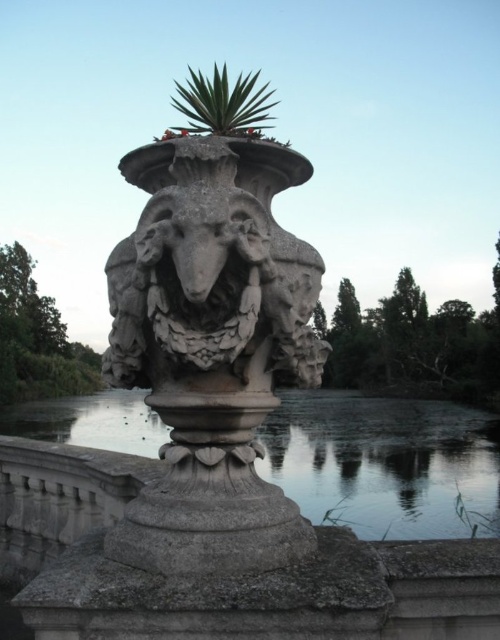
Can you confirm if transparent water at base center is shorter than green leafy plant at center?

Incorrect, transparent water at base center's height does not fall short of green leafy plant at center's.

Can you confirm if transparent water at base center is bigger than green leafy plant at center?

Indeed, transparent water at base center has a larger size compared to green leafy plant at center.

Where is `transparent water at base center`? The image size is (500, 640). transparent water at base center is located at coordinates (382, 461).

Consider the image. Who is positioned more to the right, green leafy plant at top or green leafy plant at center?

green leafy plant at center

Can you confirm if green leafy plant at top is bigger than green leafy plant at center?

Yes.

The image size is (500, 640). What do you see at coordinates (222, 104) in the screenshot?
I see `green leafy plant at top` at bounding box center [222, 104].

The image size is (500, 640). Find the location of `green leafy plant at top`. green leafy plant at top is located at coordinates (222, 104).

Can you confirm if transparent water at base center is thinner than green leafy plant at top?

No, transparent water at base center is not thinner than green leafy plant at top.

This screenshot has width=500, height=640. Find the location of `transparent water at base center`. transparent water at base center is located at coordinates (382, 461).